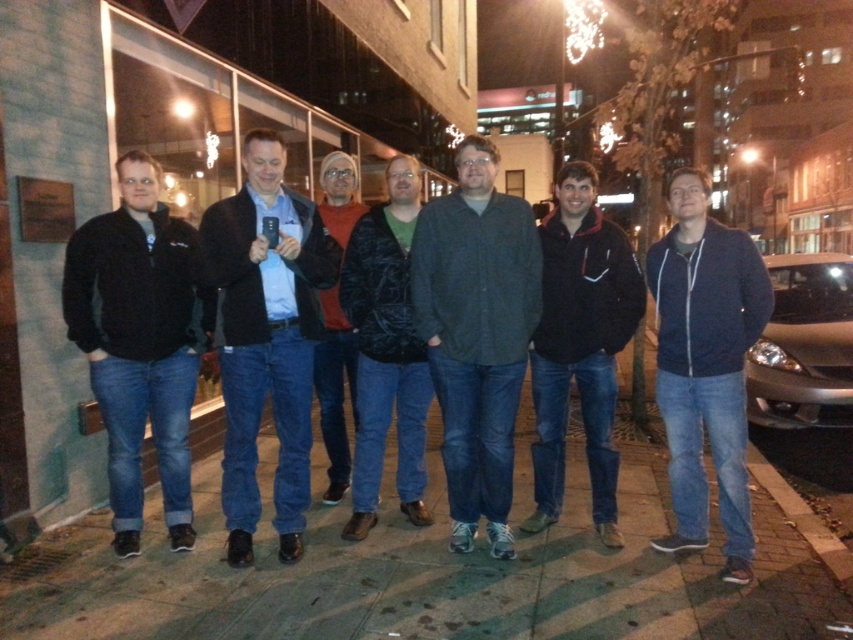
You are trying to decide which jacket to wear for a casual night out. Both the black fleece jacket at left and the dark gray textured jacket at center are options. Based on their sizes shown in the image, which one would you choose if you prefer a more oversized look?

The black fleece jacket at left is bigger than the dark gray textured jacket at center, so you should choose the black fleece jacket at left for a more oversized look.

You are a photographer trying to frame a group shot. You notice two jackets in the image, the black fleece jacket at left and the black matte jacket at center. Which jacket takes up more horizontal space in the photo?

The black fleece jacket at left might be wider than black matte jacket at center, so it takes up more horizontal space in the photo.